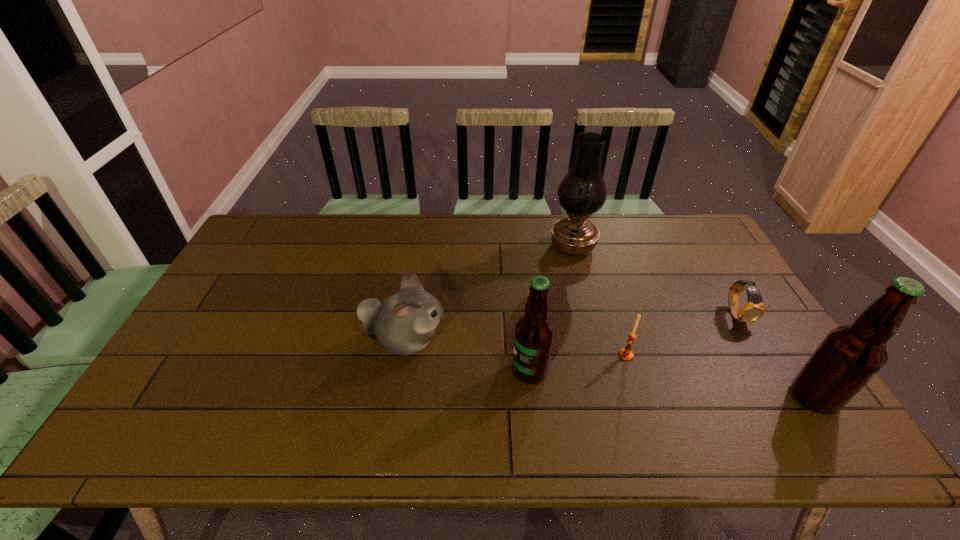
Please point a spot to add another beer bottle on the left. Please provide its 2D coordinates. Your answer should be formatted as a tuple, i.e. [(x, y)], where the tuple contains the x and y coordinates of a point satisfying the conditions above.

[(273, 347)]